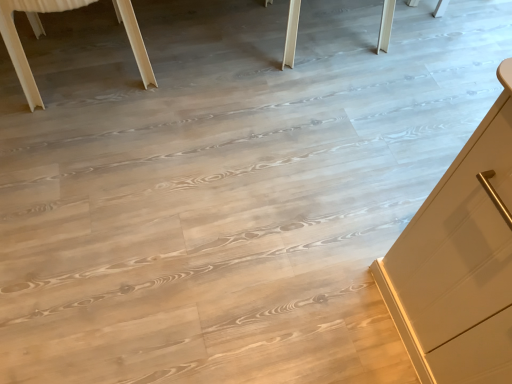
Question: From the image's perspective, relative to natural wood table at upper center, is light wood table at upper left above or below?

Choices:
 (A) above
 (B) below

Answer: (B)

Question: Visually, is light wood table at upper left positioned to the left or to the right of natural wood table at upper center?

Choices:
 (A) right
 (B) left

Answer: (B)

Question: Do you think light wood table at upper left is within natural wood table at upper center, or outside of it?

Choices:
 (A) inside
 (B) outside

Answer: (A)

Question: Would you say natural wood table at upper center is inside or outside light wood table at upper left?

Choices:
 (A) outside
 (B) inside

Answer: (A)

Question: From the image's perspective, is natural wood table at upper center above or below light wood table at upper left?

Choices:
 (A) above
 (B) below

Answer: (A)

Question: Does point (437, 1) appear closer or farther from the camera than point (130, 19)?

Choices:
 (A) farther
 (B) closer

Answer: (A)

Question: In terms of size, does natural wood table at upper center appear bigger or smaller than light wood table at upper left?

Choices:
 (A) small
 (B) big

Answer: (B)